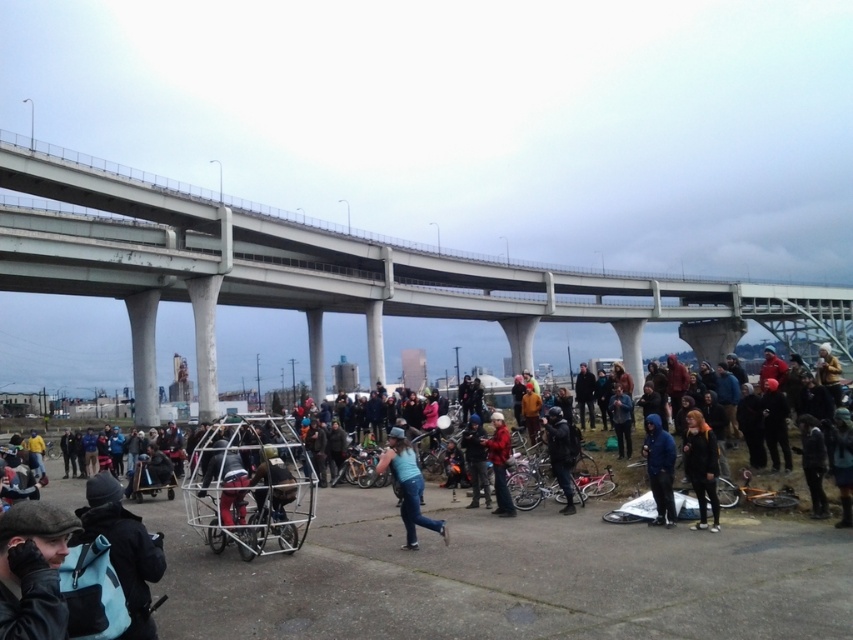
Question: Is dark brown leather hat at lower left to the right of dark gray hoodie at center from the viewer's perspective?

Choices:
 (A) no
 (B) yes

Answer: (A)

Question: Is black fabric backpack at lower left above dark blue fabric jacket at lower right?

Choices:
 (A) no
 (B) yes

Answer: (A)

Question: Which point appears farthest from the camera in this image?

Choices:
 (A) (830, 460)
 (B) (496, 413)
 (C) (561, 432)

Answer: (B)

Question: Where is blue denim jeans at center located in relation to black matte jacket at lower right in the image?

Choices:
 (A) above
 (B) below

Answer: (B)

Question: Which of these objects is positioned farthest from the dark gray hoodie at center?

Choices:
 (A) black matte jacket at center
 (B) dark brown leather hat at lower left
 (C) white concrete bridge at center
 (D) black matte jacket at lower right

Answer: (C)

Question: Which point is closer to the camera?

Choices:
 (A) (115, 508)
 (B) (479, 464)

Answer: (A)